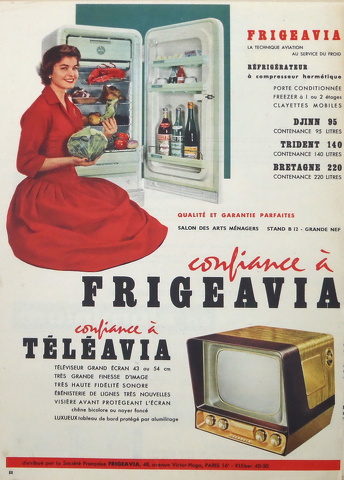
At what (x,y) coordinates should I click in order to perform the action: click on glass bottles. Please return your answer as a coordinate pair (x, y). Looking at the image, I should click on (188, 135), (176, 134), (162, 136), (180, 74), (172, 76).